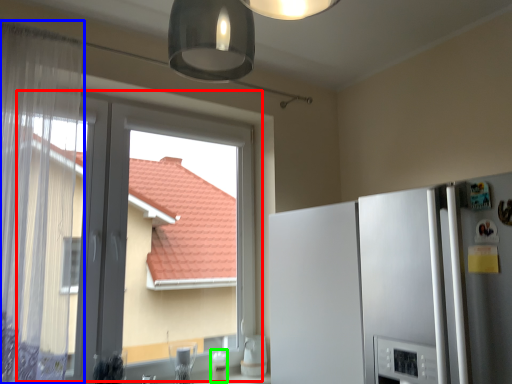
Question: Which is farther away from window (highlighted by a red box)? curtain (highlighted by a blue box) or appliance (highlighted by a green box)?

Choices:
 (A) curtain
 (B) appliance

Answer: (B)